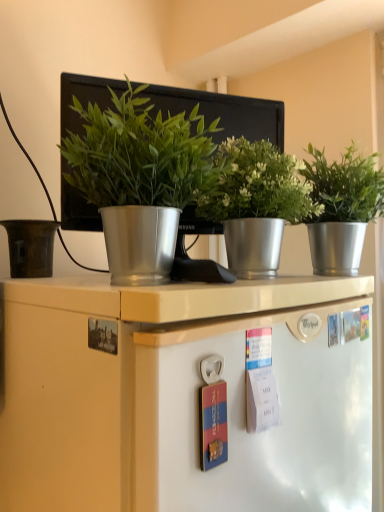
Question: Can you see green metallic plant pot at center, which is the third houseplant in right-to-left order, touching metallic silver pot at center, the 2th houseplant viewed from the left?

Choices:
 (A) no
 (B) yes

Answer: (A)

Question: Is green metallic plant pot at center, the first houseplant positioned from the left, not near metallic silver pot at center, which is counted as the second houseplant, starting from the right?

Choices:
 (A) yes
 (B) no

Answer: (B)

Question: Is green metallic plant pot at center, which is the third houseplant in right-to-left order, to the right of metallic silver pot at center, the 2th houseplant viewed from the left, from the viewer's perspective?

Choices:
 (A) no
 (B) yes

Answer: (A)

Question: Is green metallic plant pot at center, the first houseplant positioned from the left, further to camera compared to metallic silver pot at center, the 2th houseplant viewed from the left?

Choices:
 (A) no
 (B) yes

Answer: (A)

Question: Is the position of green metallic plant pot at center, which is the third houseplant in right-to-left order, less distant than that of metallic silver pot at center, the 2th houseplant viewed from the left?

Choices:
 (A) yes
 (B) no

Answer: (A)

Question: From the image's perspective, is metallic silver pot at center, which is counted as the second houseplant, starting from the right, positioned above or below matte brown pot at left?

Choices:
 (A) above
 (B) below

Answer: (A)

Question: Is metallic silver pot at center, the 2th houseplant viewed from the left, in front of or behind matte brown pot at left in the image?

Choices:
 (A) behind
 (B) front

Answer: (B)

Question: Is point (226, 233) closer or farther from the camera than point (34, 267)?

Choices:
 (A) farther
 (B) closer

Answer: (B)

Question: Visually, is metallic silver pot at center, which is counted as the second houseplant, starting from the right, positioned to the left or to the right of matte brown pot at left?

Choices:
 (A) left
 (B) right

Answer: (B)

Question: Is point (369, 179) positioned closer to the camera than point (69, 146)?

Choices:
 (A) closer
 (B) farther

Answer: (B)

Question: From the image's perspective, is silver metallic pot at right, which is the 3th houseplant in left-to-right order, located above or below green metallic plant pot at center, which is the third houseplant in right-to-left order?

Choices:
 (A) above
 (B) below

Answer: (B)

Question: From their relative heights in the image, would you say silver metallic pot at right, which is the 3th houseplant in left-to-right order, is taller or shorter than green metallic plant pot at center, the first houseplant positioned from the left?

Choices:
 (A) tall
 (B) short

Answer: (A)

Question: Would you say silver metallic pot at right, which is the 3th houseplant in left-to-right order, is inside or outside green metallic plant pot at center, the first houseplant positioned from the left?

Choices:
 (A) inside
 (B) outside

Answer: (B)

Question: Visually, is matte brown pot at left positioned to the left or to the right of metallic silver pot at center, which is counted as the second houseplant, starting from the right?

Choices:
 (A) left
 (B) right

Answer: (A)

Question: In terms of height, does matte brown pot at left look taller or shorter compared to metallic silver pot at center, which is counted as the second houseplant, starting from the right?

Choices:
 (A) short
 (B) tall

Answer: (A)